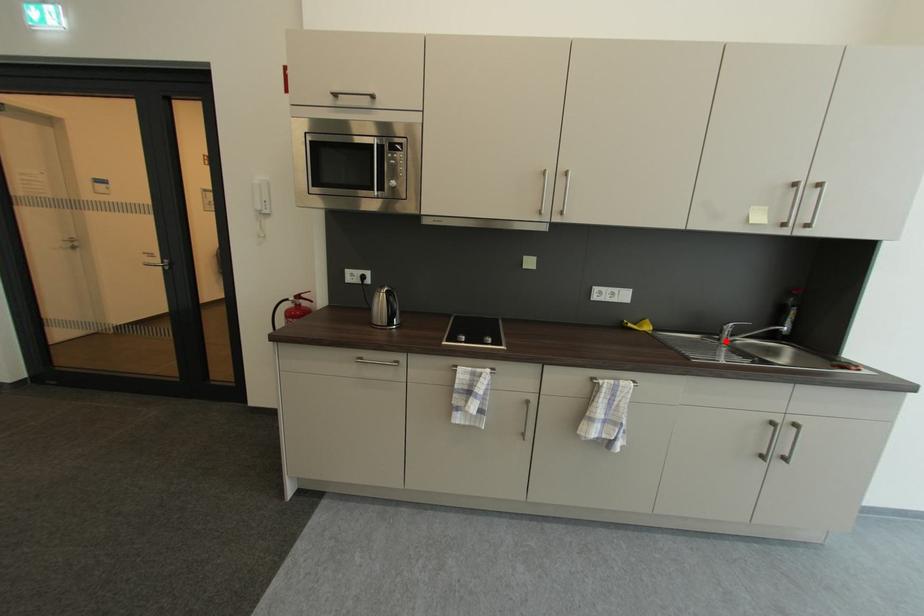
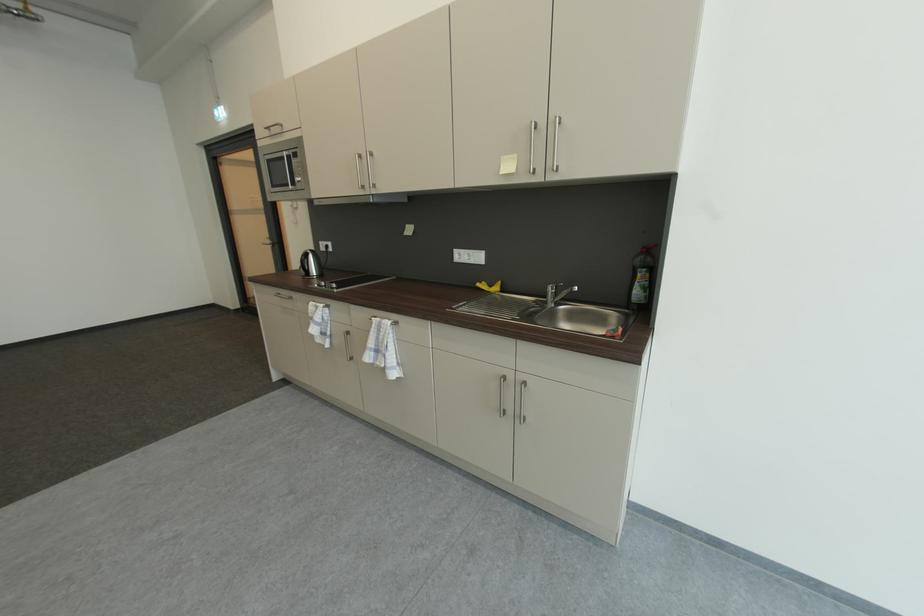
Locate, in the second image, the point that corresponds to the highlighted location in the first image.

(553, 304)